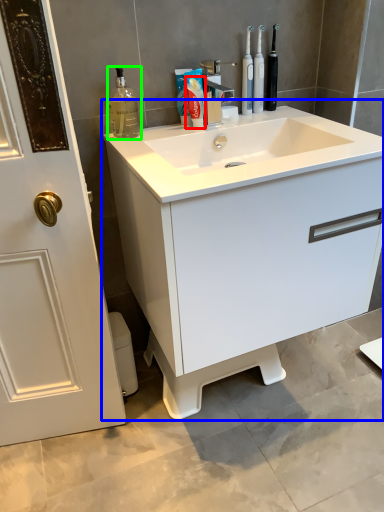
Question: Which is nearer to the toothpaste (highlighted by a red box)? bathroom cabinet (highlighted by a blue box) or cleaning product (highlighted by a green box).

Choices:
 (A) bathroom cabinet
 (B) cleaning product

Answer: (B)